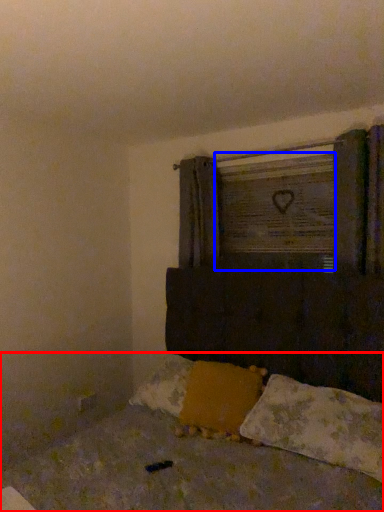
Question: Which object is further to the camera taking this photo, bed (highlighted by a red box) or window frame (highlighted by a blue box)?

Choices:
 (A) bed
 (B) window frame

Answer: (B)